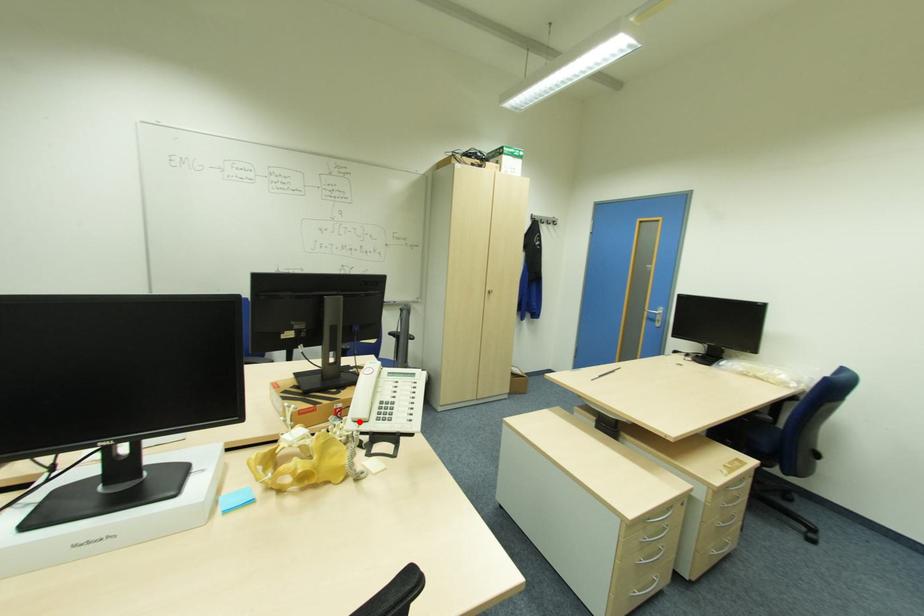
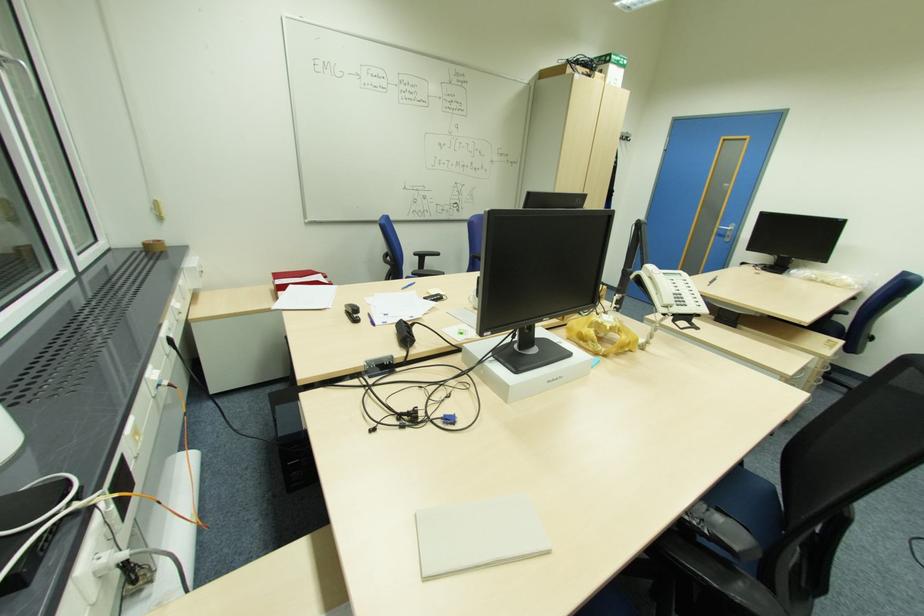
The point at the highlighted location is marked in the first image. Where is the corresponding point in the second image?

(670, 306)